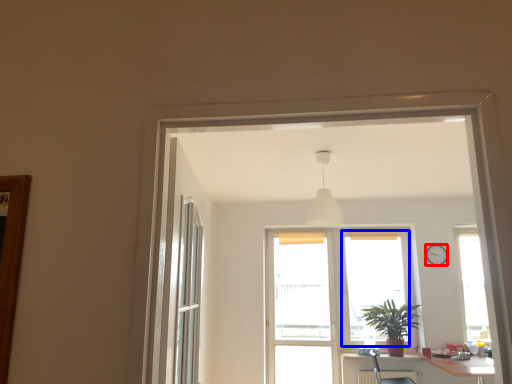
Question: Which object is further to the camera taking this photo, clock (highlighted by a red box) or window screen (highlighted by a blue box)?

Choices:
 (A) clock
 (B) window screen

Answer: (B)